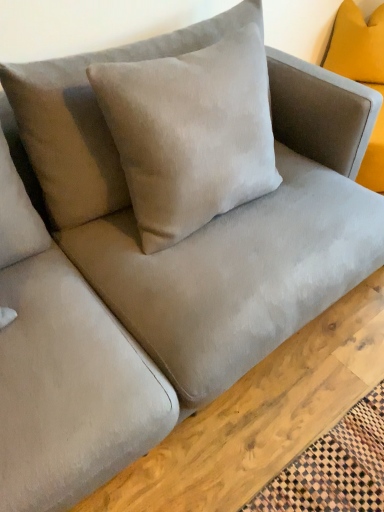
Image resolution: width=384 pixels, height=512 pixels. In order to click on suede-like beige pillow at center, positioned as the 1th pillow in front-to-back order in this screenshot , I will do `click(91, 118)`.

Image resolution: width=384 pixels, height=512 pixels. Describe the element at coordinates (91, 118) in the screenshot. I see `suede-like beige pillow at center, placed as the 2th pillow when sorted from right to left` at that location.

Image resolution: width=384 pixels, height=512 pixels. What are the coordinates of `matte gray couch at center` in the screenshot? It's located at (261, 415).

Can you tell me how much matte gray couch at center and suede-like beige pillow at center, which is the second pillow from back to front, differ in facing direction?

179 degrees.

Which object is further away from the camera, matte gray couch at center or suede-like beige pillow at center, placed as the 2th pillow when sorted from right to left?

matte gray couch at center is more distant.

Looking at this image, considering the sizes of objects matte gray couch at center and suede-like beige pillow at center, positioned as the 2th pillow in top-to-bottom order, in the image provided, who is thinner, matte gray couch at center or suede-like beige pillow at center, positioned as the 2th pillow in top-to-bottom order,?

Thinner between the two is suede-like beige pillow at center, positioned as the 2th pillow in top-to-bottom order.

Considering the positions of points (145, 470) and (68, 146), is point (145, 470) closer to camera compared to point (68, 146)?

Yes, it is.

Is mustard velvet pillow at upper right, acting as the 1th pillow starting from the top, shorter than matte gray couch at center?

In fact, mustard velvet pillow at upper right, acting as the 1th pillow starting from the top, may be taller than matte gray couch at center.

From the image's perspective, is mustard velvet pillow at upper right, placed as the 2th pillow when sorted from front to back, on top of matte gray couch at center?

Correct, mustard velvet pillow at upper right, placed as the 2th pillow when sorted from front to back, appears higher than matte gray couch at center in the image.

Could you tell me if mustard velvet pillow at upper right, which ranks as the first pillow in right-to-left order, is facing matte gray couch at center?

No, mustard velvet pillow at upper right, which ranks as the first pillow in right-to-left order, is not aimed at matte gray couch at center.

Considering the sizes of objects matte gray couch at center and mustard velvet pillow at upper right, which appears as the 2th pillow when viewed from the left, in the image provided, who is wider, matte gray couch at center or mustard velvet pillow at upper right, which appears as the 2th pillow when viewed from the left,?

matte gray couch at center.

Is point (263, 453) closer to camera compared to point (364, 52)?

Yes, it is.

Can you tell me how much matte gray couch at center and mustard velvet pillow at upper right, placed as the 2th pillow when sorted from front to back, differ in facing direction?

matte gray couch at center and mustard velvet pillow at upper right, placed as the 2th pillow when sorted from front to back, are facing 89.2 degrees away from each other.

Is matte gray couch at center inside or outside of mustard velvet pillow at upper right, acting as the 1th pillow starting from the top?

matte gray couch at center is not enclosed by mustard velvet pillow at upper right, acting as the 1th pillow starting from the top.

Are mustard velvet pillow at upper right, placed as the 2th pillow when sorted from front to back, and suede-like beige pillow at center, positioned as the 1th pillow in front-to-back order, beside each other?

No, mustard velvet pillow at upper right, placed as the 2th pillow when sorted from front to back, is not with suede-like beige pillow at center, positioned as the 1th pillow in front-to-back order.

Does mustard velvet pillow at upper right, placed as the 2th pillow when sorted from front to back, have a smaller size compared to suede-like beige pillow at center, positioned as the 1th pillow in front-to-back order?

Correct, mustard velvet pillow at upper right, placed as the 2th pillow when sorted from front to back, occupies less space than suede-like beige pillow at center, positioned as the 1th pillow in front-to-back order.

Is mustard velvet pillow at upper right, placed as the 2th pillow when sorted from front to back, closer to camera compared to suede-like beige pillow at center, which is the second pillow from back to front?

No, it is behind suede-like beige pillow at center, which is the second pillow from back to front.

The image size is (384, 512). Identify the location of pillow in front of the mustard velvet pillow at upper right, which is the 1th pillow from back to front. (91, 118).

Are suede-like beige pillow at center, which is the second pillow from back to front, and matte gray couch at center beside each other?

suede-like beige pillow at center, which is the second pillow from back to front, and matte gray couch at center are not in contact.

From the picture: From the image's perspective, would you say suede-like beige pillow at center, positioned as the 2th pillow in top-to-bottom order, is positioned over matte gray couch at center?

Yes, from the image's perspective, suede-like beige pillow at center, positioned as the 2th pillow in top-to-bottom order, is above matte gray couch at center.

Between suede-like beige pillow at center, positioned as the 2th pillow in top-to-bottom order, and matte gray couch at center, which one is positioned in front?

suede-like beige pillow at center, positioned as the 2th pillow in top-to-bottom order, is closer to the camera.

Is suede-like beige pillow at center, placed as the 2th pillow when sorted from right to left, aimed at matte gray couch at center?

No, suede-like beige pillow at center, placed as the 2th pillow when sorted from right to left, is not aimed at matte gray couch at center.

Would you say suede-like beige pillow at center, positioned as the 1th pillow in bottom-to-top order, is a long distance from mustard velvet pillow at upper right, which is the 1th pillow from back to front?

suede-like beige pillow at center, positioned as the 1th pillow in bottom-to-top order, is far away from mustard velvet pillow at upper right, which is the 1th pillow from back to front.

Can you confirm if suede-like beige pillow at center, positioned as the 2th pillow in top-to-bottom order, is taller than mustard velvet pillow at upper right, which appears as the 2th pillow when viewed from the left?

Yes, suede-like beige pillow at center, positioned as the 2th pillow in top-to-bottom order, is taller than mustard velvet pillow at upper right, which appears as the 2th pillow when viewed from the left.

Does suede-like beige pillow at center, which is the second pillow from back to front, lie in front of mustard velvet pillow at upper right, arranged as the second pillow when ordered from the bottom?

Yes.

At what (x,y) coordinates should I click in order to perform the action: click on pillow on the left side of mustard velvet pillow at upper right, acting as the 1th pillow starting from the top. Please return your answer as a coordinate pair (x, y). The height and width of the screenshot is (512, 384). Looking at the image, I should click on (91, 118).

You are a GUI agent. You are given a task and a screenshot of the screen. Output one action in this format:
    pyautogui.click(x=<x>, y=<y>)
    Task: Click on the plank that appears behind the suede-like beige pillow at center, which is the second pillow from back to front
    
    Given the screenshot: What is the action you would take?
    [x=261, y=415]

The image size is (384, 512). Identify the location of the 1st pillow above the matte gray couch at center (from a real-world perspective). (357, 45).

Which object lies nearer to the anchor point suede-like beige pillow at center, placed as the 2th pillow when sorted from right to left, matte gray couch at center or mustard velvet pillow at upper right, placed as the 2th pillow when sorted from front to back?

matte gray couch at center is closer to suede-like beige pillow at center, placed as the 2th pillow when sorted from right to left.

From the image, which object appears to be nearer to matte gray couch at center, suede-like beige pillow at center, positioned as the 1th pillow in bottom-to-top order, or mustard velvet pillow at upper right, which appears as the 2th pillow when viewed from the left?

suede-like beige pillow at center, positioned as the 1th pillow in bottom-to-top order, is positioned closer to the anchor matte gray couch at center.

Looking at the image, which one is located further to matte gray couch at center, mustard velvet pillow at upper right, acting as the 1th pillow starting from the top, or suede-like beige pillow at center, placed as the 2th pillow when sorted from right to left?

Based on the image, mustard velvet pillow at upper right, acting as the 1th pillow starting from the top, appears to be further to matte gray couch at center.

From the image, which object appears to be nearer to suede-like beige pillow at center, positioned as the 1th pillow in front-to-back order, mustard velvet pillow at upper right, placed as the 2th pillow when sorted from front to back, or matte gray couch at center?

matte gray couch at center is positioned closer to the anchor suede-like beige pillow at center, positioned as the 1th pillow in front-to-back order.

In the scene shown: Based on their spatial positions, is suede-like beige pillow at center, positioned as the 1th pillow in front-to-back order, or matte gray couch at center closer to mustard velvet pillow at upper right, which appears as the 2th pillow when viewed from the left?

suede-like beige pillow at center, positioned as the 1th pillow in front-to-back order.

Looking at the image, which one is located closer to mustard velvet pillow at upper right, placed as the 2th pillow when sorted from front to back, matte gray couch at center or suede-like beige pillow at center, which is the second pillow from back to front?

suede-like beige pillow at center, which is the second pillow from back to front, is closer to mustard velvet pillow at upper right, placed as the 2th pillow when sorted from front to back.

What are the coordinates of `pillow between mustard velvet pillow at upper right, which is the 1th pillow from back to front, and matte gray couch at center from top to bottom` in the screenshot? It's located at (91, 118).